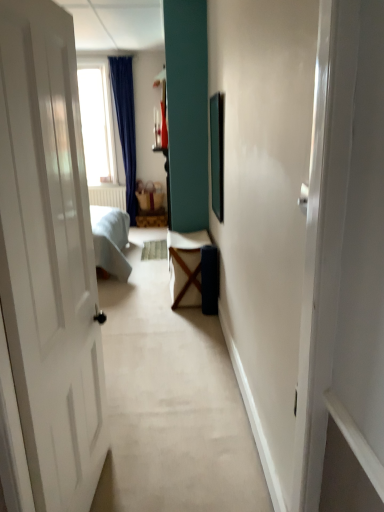
Question: Considering the relative sizes of matte brown basket at center and white fabric table at center in the image provided, is matte brown basket at center bigger than white fabric table at center?

Choices:
 (A) yes
 (B) no

Answer: (B)

Question: Does matte brown basket at center come behind white fabric table at center?

Choices:
 (A) yes
 (B) no

Answer: (A)

Question: Is matte brown basket at center next to white fabric table at center and touching it?

Choices:
 (A) yes
 (B) no

Answer: (B)

Question: Does matte brown basket at center come in front of white fabric table at center?

Choices:
 (A) no
 (B) yes

Answer: (A)

Question: Is matte brown basket at center at the left side of white fabric table at center?

Choices:
 (A) no
 (B) yes

Answer: (B)

Question: Would you say matte brown basket at center is inside or outside white fabric table at center?

Choices:
 (A) outside
 (B) inside

Answer: (A)

Question: Does point (140, 204) appear closer or farther from the camera than point (175, 249)?

Choices:
 (A) farther
 (B) closer

Answer: (A)

Question: In the image, is matte brown basket at center on the left side or the right side of white fabric table at center?

Choices:
 (A) left
 (B) right

Answer: (A)

Question: Considering their positions, is matte brown basket at center located in front of or behind white fabric table at center?

Choices:
 (A) behind
 (B) front

Answer: (A)

Question: From the image's perspective, is metallic silver picture frame at center above or below white fabric table at center?

Choices:
 (A) below
 (B) above

Answer: (B)

Question: Is metallic silver picture frame at center inside or outside of white fabric table at center?

Choices:
 (A) outside
 (B) inside

Answer: (A)

Question: Would you say metallic silver picture frame at center is to the left or to the right of white fabric table at center in the picture?

Choices:
 (A) left
 (B) right

Answer: (B)

Question: Is metallic silver picture frame at center in front of or behind white fabric table at center in the image?

Choices:
 (A) behind
 (B) front

Answer: (B)

Question: Considering the positions of point (200, 298) and point (223, 158), is point (200, 298) closer or farther from the camera than point (223, 158)?

Choices:
 (A) closer
 (B) farther

Answer: (B)

Question: From a real-world perspective, relative to metallic silver picture frame at center, is white fabric table at center vertically above or below?

Choices:
 (A) below
 (B) above

Answer: (A)